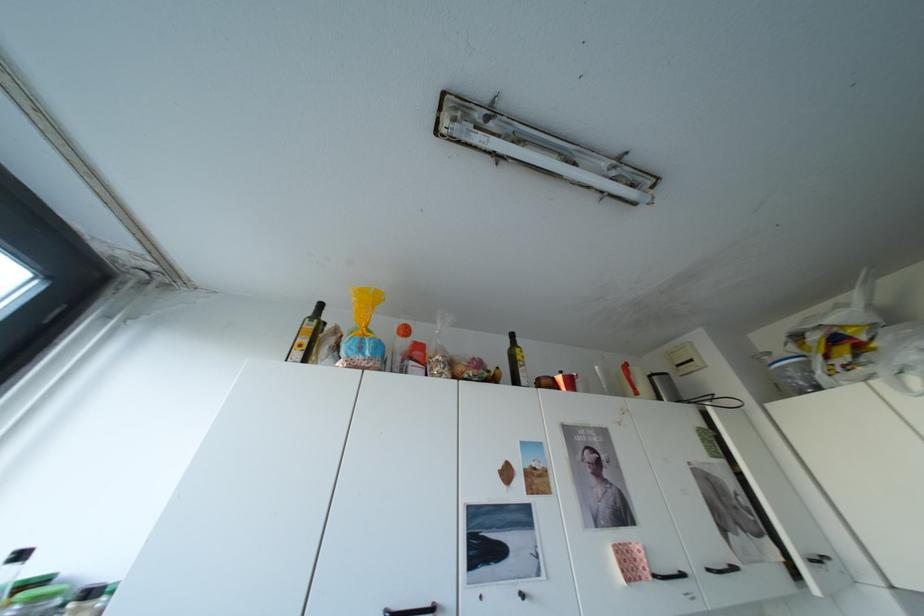
Which object does [794,375] point to?

This point indicates the container with blue lid.